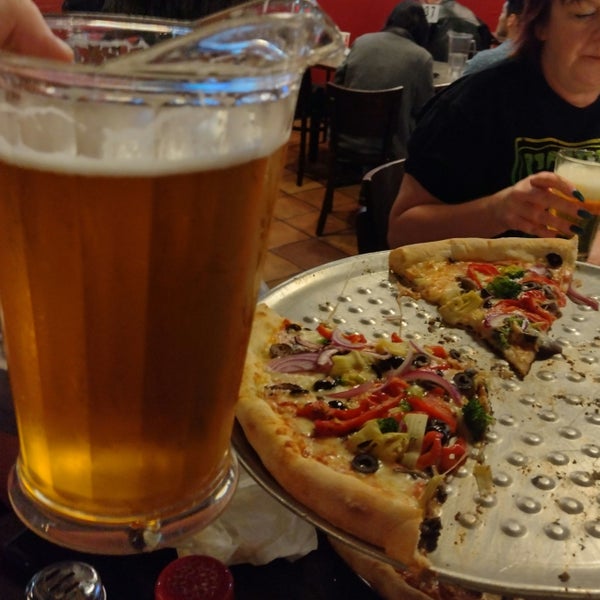
Find the location of a particular element. beer mugs is located at coordinates (183, 434), (589, 175).